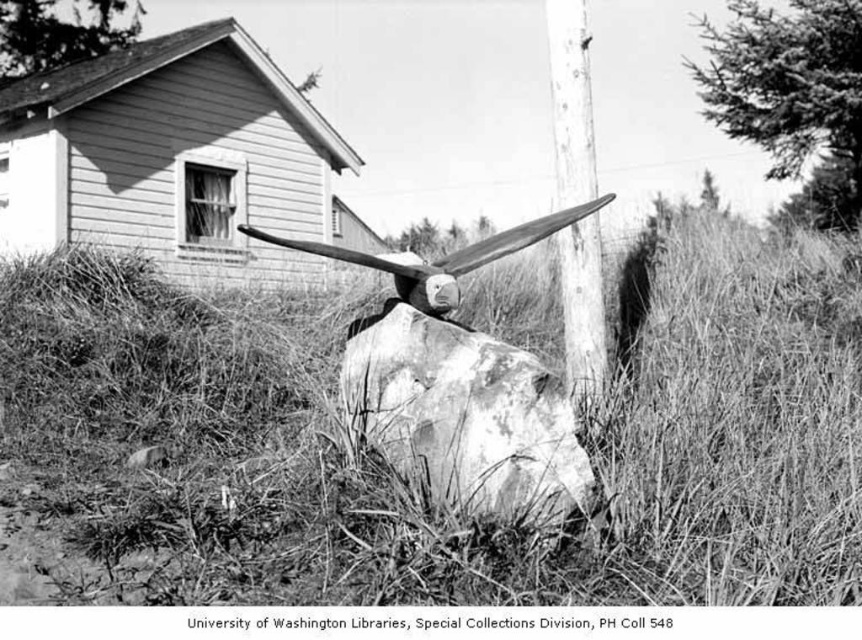
Question: Among these objects, which one is nearest to the camera?

Choices:
 (A) smooth wood pole at center
 (B) speckled concrete rock at center
 (C) wooden propeller at center

Answer: (B)

Question: Is dry grass at center wider than wooden propeller at center?

Choices:
 (A) yes
 (B) no

Answer: (A)

Question: Does speckled concrete rock at center appear under smooth wood pole at center?

Choices:
 (A) no
 (B) yes

Answer: (B)

Question: Does speckled concrete rock at center have a smaller size compared to wooden propeller at center?

Choices:
 (A) yes
 (B) no

Answer: (B)

Question: Which point is closer to the camera?

Choices:
 (A) (317, 248)
 (B) (585, 275)
 (C) (807, 531)

Answer: (C)

Question: Which object appears farthest from the camera in this image?

Choices:
 (A) dry grass at center
 (B) smooth wood pole at center

Answer: (B)